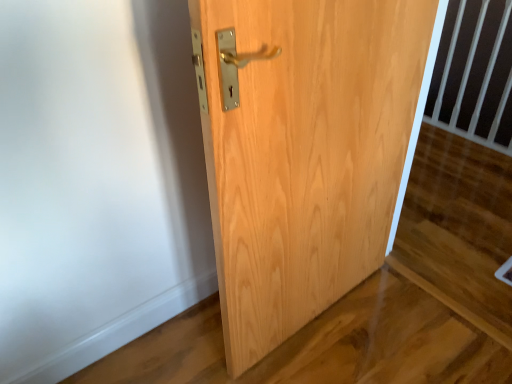
Question: Considering the relative sizes of black plastic balustrade at upper right and natural wood door at center in the image provided, is black plastic balustrade at upper right wider than natural wood door at center?

Choices:
 (A) yes
 (B) no

Answer: (B)

Question: Is the depth of black plastic balustrade at upper right greater than that of natural wood door at center?

Choices:
 (A) no
 (B) yes

Answer: (B)

Question: Is black plastic balustrade at upper right far away from natural wood door at center?

Choices:
 (A) no
 (B) yes

Answer: (B)

Question: From a real-world perspective, is black plastic balustrade at upper right positioned over natural wood door at center based on gravity?

Choices:
 (A) no
 (B) yes

Answer: (A)

Question: Can you confirm if black plastic balustrade at upper right is shorter than natural wood door at center?

Choices:
 (A) no
 (B) yes

Answer: (B)

Question: Does black plastic balustrade at upper right touch natural wood door at center?

Choices:
 (A) yes
 (B) no

Answer: (B)

Question: Can you confirm if natural wood door at center is smaller than black plastic balustrade at upper right?

Choices:
 (A) no
 (B) yes

Answer: (A)

Question: Does natural wood door at center have a lesser height compared to black plastic balustrade at upper right?

Choices:
 (A) yes
 (B) no

Answer: (B)

Question: Can you confirm if natural wood door at center is bigger than black plastic balustrade at upper right?

Choices:
 (A) yes
 (B) no

Answer: (A)

Question: From the image's perspective, is natural wood door at center on top of black plastic balustrade at upper right?

Choices:
 (A) yes
 (B) no

Answer: (B)

Question: Is natural wood door at center thinner than black plastic balustrade at upper right?

Choices:
 (A) no
 (B) yes

Answer: (A)

Question: Does natural wood door at center appear on the right side of black plastic balustrade at upper right?

Choices:
 (A) no
 (B) yes

Answer: (A)

Question: In the image, is natural wood door at center on the left side or the right side of black plastic balustrade at upper right?

Choices:
 (A) left
 (B) right

Answer: (A)